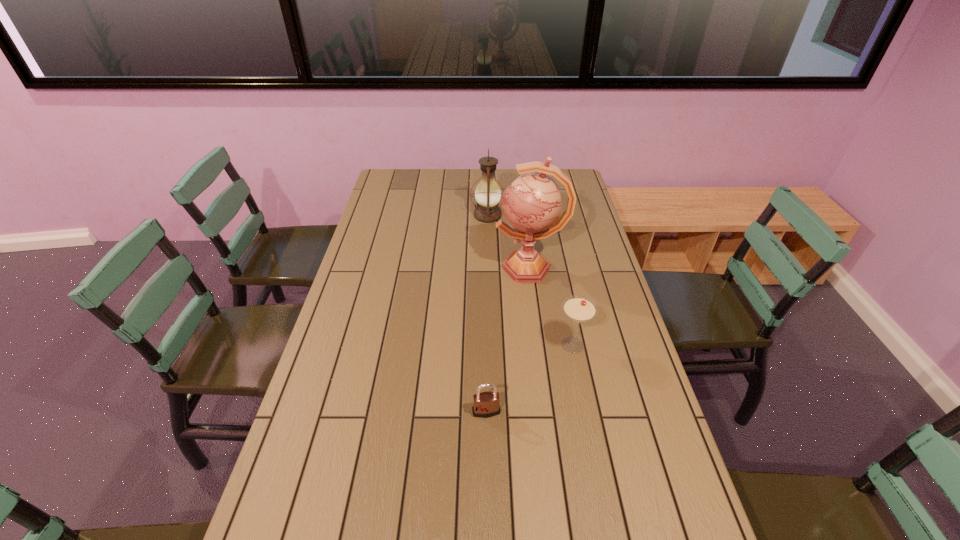
Image resolution: width=960 pixels, height=540 pixels. Identify the location of free space located on the front-facing side of the second farthest object. (382, 268).

This screenshot has height=540, width=960. I want to click on free space located 0.400m on the left of the farthest object, so click(x=373, y=215).

This screenshot has width=960, height=540. Identify the location of vacant space positioned on the back of the second shortest object. (562, 292).

This screenshot has height=540, width=960. What are the coordinates of `free location located 0.090m on the front of the padlock` in the screenshot? It's located at (487, 452).

Identify the location of globe at the right edge. This screenshot has height=540, width=960. (532, 205).

Identify the location of martini present at the right edge. The width and height of the screenshot is (960, 540). (579, 309).

Identify the location of vacant space at the far edge of the desktop. 499,185.

You are a GUI agent. You are given a task and a screenshot of the screen. Output one action in this format:
    pyautogui.click(x=<x>, y=<y>)
    Task: Click on the vacant space at the left edge
    
    Given the screenshot: What is the action you would take?
    pyautogui.click(x=348, y=333)

You are a GUI agent. You are given a task and a screenshot of the screen. Output one action in this format:
    pyautogui.click(x=<x>, y=<y>)
    Task: Click on the free space at the right edge
    This screenshot has height=540, width=960.
    Given the screenshot: What is the action you would take?
    (x=610, y=430)

This screenshot has width=960, height=540. In the image, there is a desktop. Find the location of `blank space at the far right corner`. blank space at the far right corner is located at coordinates (573, 171).